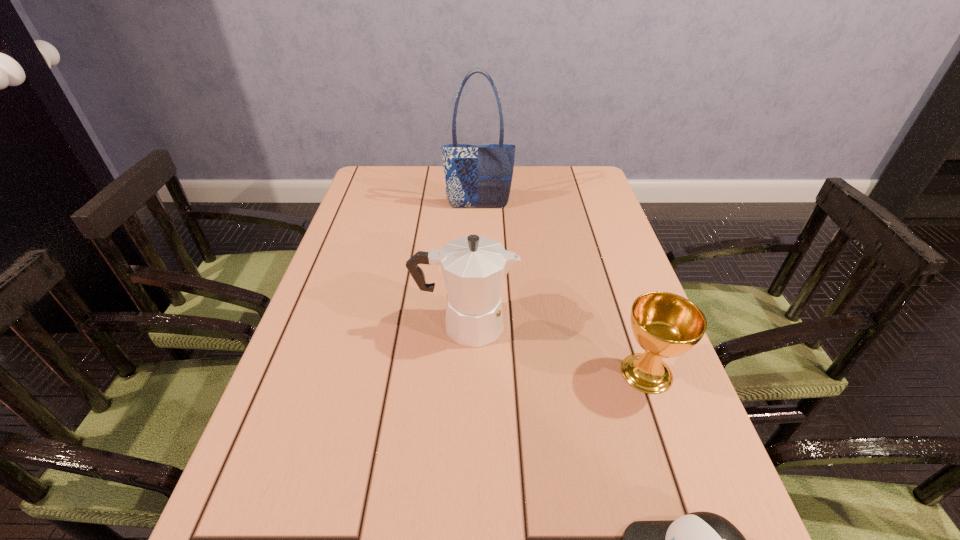
You are a GUI agent. You are given a task and a screenshot of the screen. Output one action in this format:
    pyautogui.click(x=<x>, y=<y>)
    Task: Click on the vacant space at the far edge of the desktop
    Image resolution: width=960 pixels, height=540 pixels.
    Given the screenshot: What is the action you would take?
    pyautogui.click(x=521, y=187)

What are the coordinates of `free space at the left edge of the desktop` in the screenshot? It's located at (343, 284).

Locate an element on the screen. This screenshot has width=960, height=540. vacant space at the right edge is located at coordinates (607, 285).

Where is `vacant position at the far left corner of the desktop`? The height and width of the screenshot is (540, 960). vacant position at the far left corner of the desktop is located at coordinates (404, 172).

This screenshot has width=960, height=540. I want to click on vacant region at the far right corner, so click(x=582, y=181).

This screenshot has width=960, height=540. What are the coordinates of `unoccupied position between the second nearest object and the third shortest object` in the screenshot? It's located at pos(556,349).

The image size is (960, 540). In order to click on object that is the third closest one to the nearest object in this screenshot , I will do `click(477, 176)`.

Locate an element on the screen. object that is the second closest one to the second farthest object is located at coordinates (701, 539).

At what (x,y) coordinates should I click in order to perform the action: click on free space that satisfies the following two spatial constraints: 1. on the back side of the second shortest object; 2. at the spout of the second farthest object. Please return your answer as a coordinate pair (x, y). The width and height of the screenshot is (960, 540). Looking at the image, I should click on (630, 325).

This screenshot has height=540, width=960. Find the location of `free space that satisfies the following two spatial constraints: 1. at the spout of the chalice; 2. on the right side of the second farthest object`. free space that satisfies the following two spatial constraints: 1. at the spout of the chalice; 2. on the right side of the second farthest object is located at coordinates (464, 373).